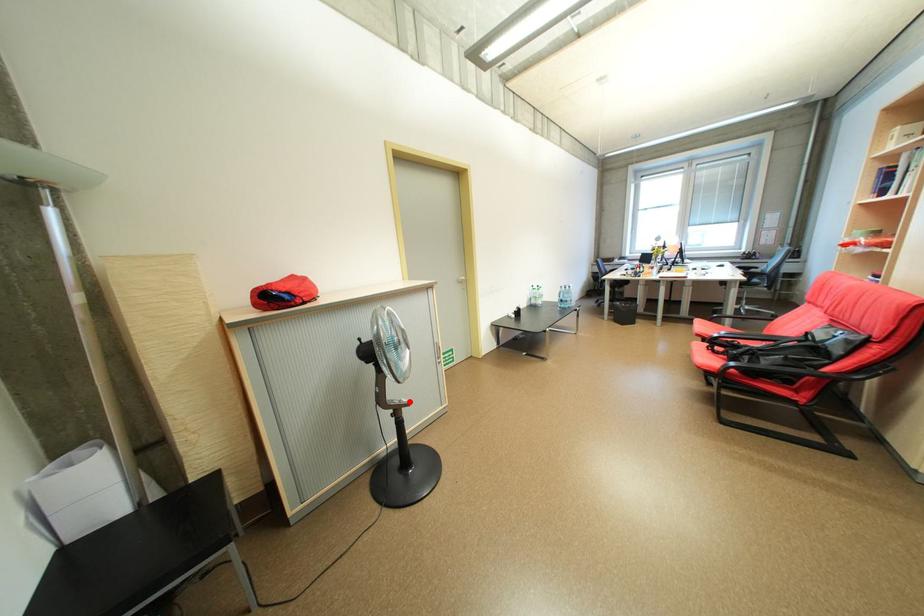
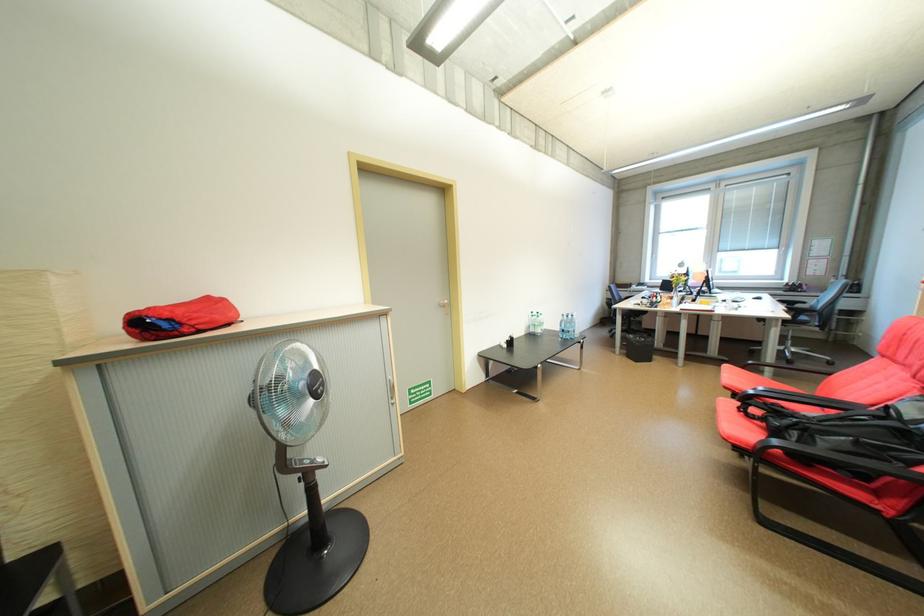
Question: I am providing you with two images of the same scene from different viewpoints. In image1, a red point is highlighted. Considering the same 3D point in image2, which of the following is correct?

Choices:
 (A) It is closer
 (B) It is farther

Answer: (A)